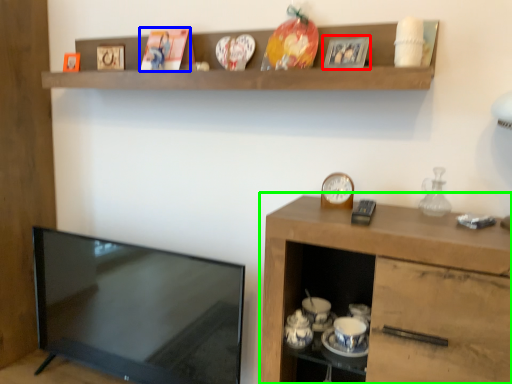
Question: Considering the real-world distances, which object is farthest from picture frame (highlighted by a red box)? picture frame (highlighted by a blue box) or cabinetry (highlighted by a green box)?

Choices:
 (A) picture frame
 (B) cabinetry

Answer: (B)